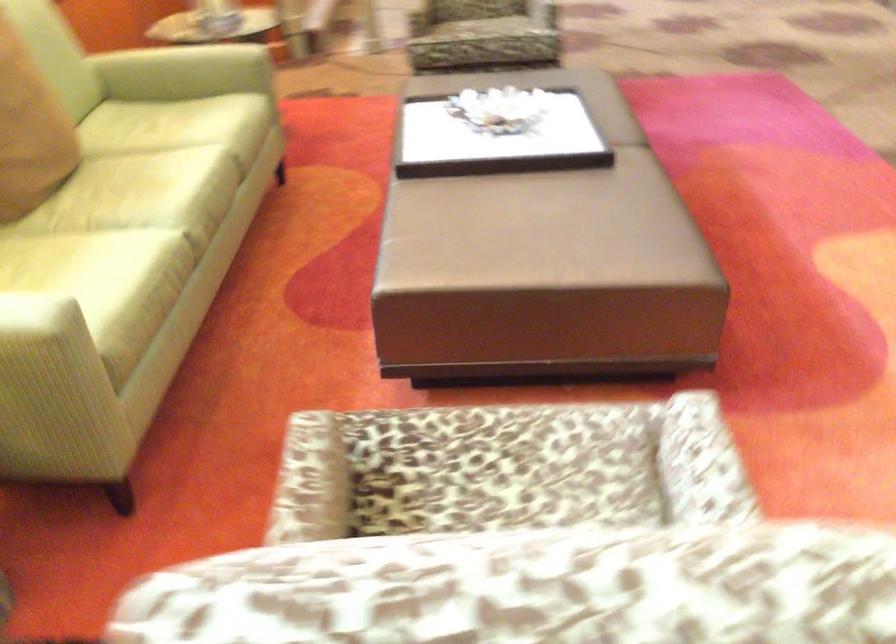
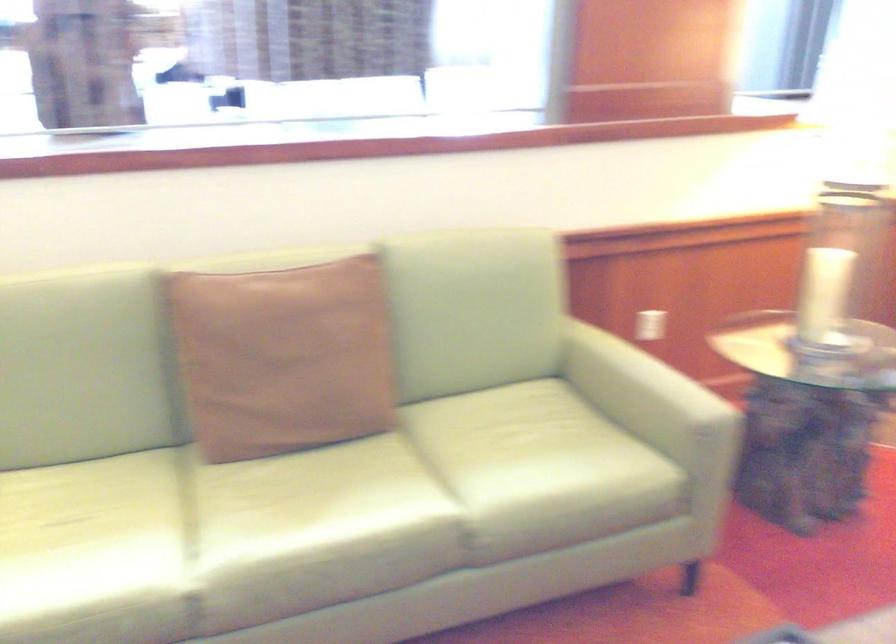
In the second image, find the point that corresponds to [126,189] in the first image.

(299, 498)